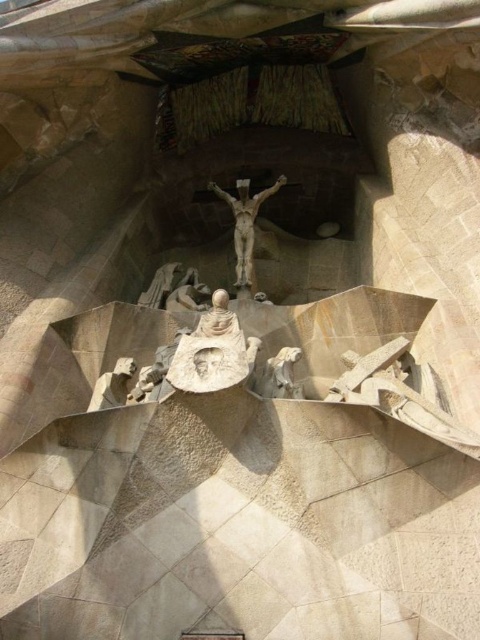
Based on the photo, you are an art student analyzing the Sagrada Familia facade. You notice the carved stone angel at center and the white stone figure at lower left. Which of these two figures is placed higher up in the composition?

The carved stone angel at center is positioned over the white stone figure at lower left, meaning it is placed higher up in the composition.

You are standing in front of the Sagrada Familia and want to take a photo of the light beige stone statue at center. If your camera has a maximum focusing range of 70 meters, will you be able to capture a clear image of the statue?

The light beige stone statue at center is 75.76 meters away from the camera. Since the maximum focusing range of your camera is 70 meters, you will not be able to capture a clear image of the statue as it exceeds the camera range.